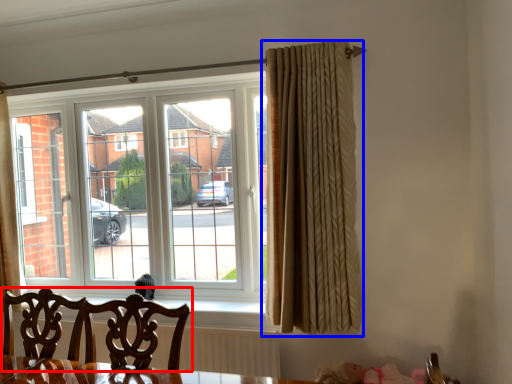
Question: Which object appears closest to the camera in this image, chair (highlighted by a red box) or curtain (highlighted by a blue box)?

Choices:
 (A) chair
 (B) curtain

Answer: (A)